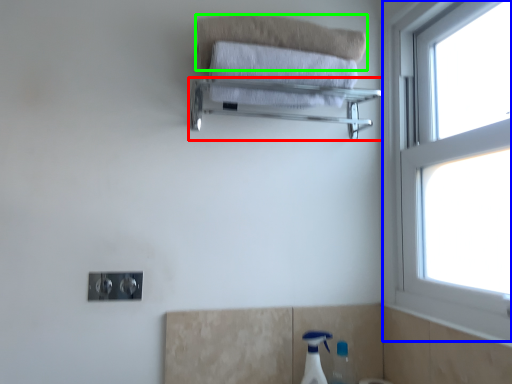
Question: Which object is positioned closest to balustrade (highlighted by a red box)? Select from window (highlighted by a blue box) and bath towel (highlighted by a green box).

Choices:
 (A) window
 (B) bath towel

Answer: (B)